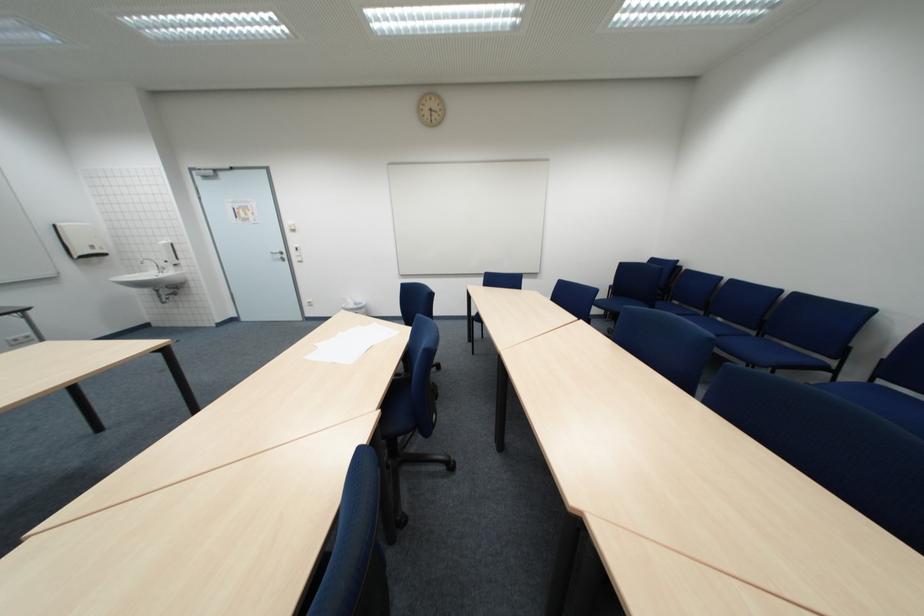
You are a GUI agent. You are given a task and a screenshot of the screen. Output one action in this format:
    pyautogui.click(x=<x>, y=<y>)
    Task: Click on the silver door handle
    
    Given the screenshot: What is the action you would take?
    pyautogui.click(x=278, y=256)